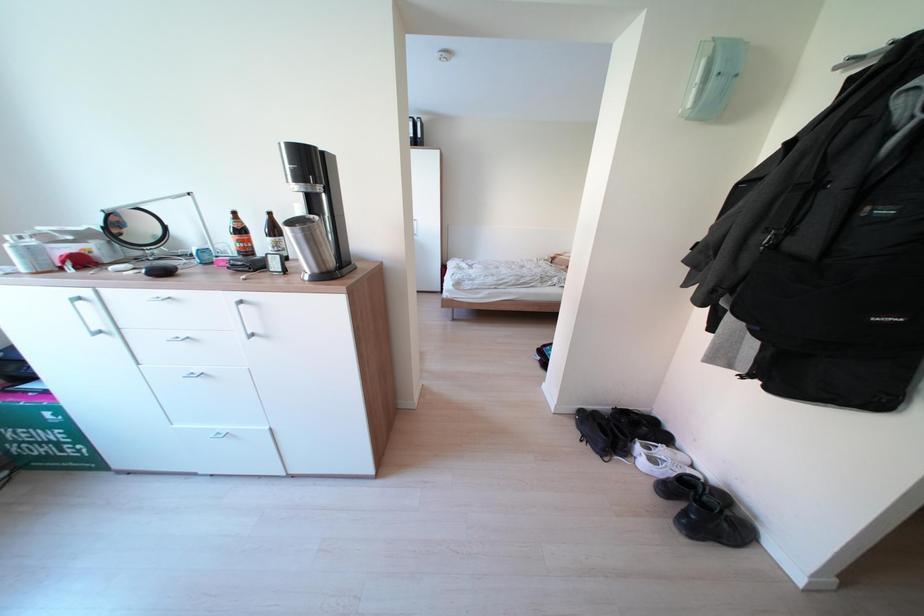
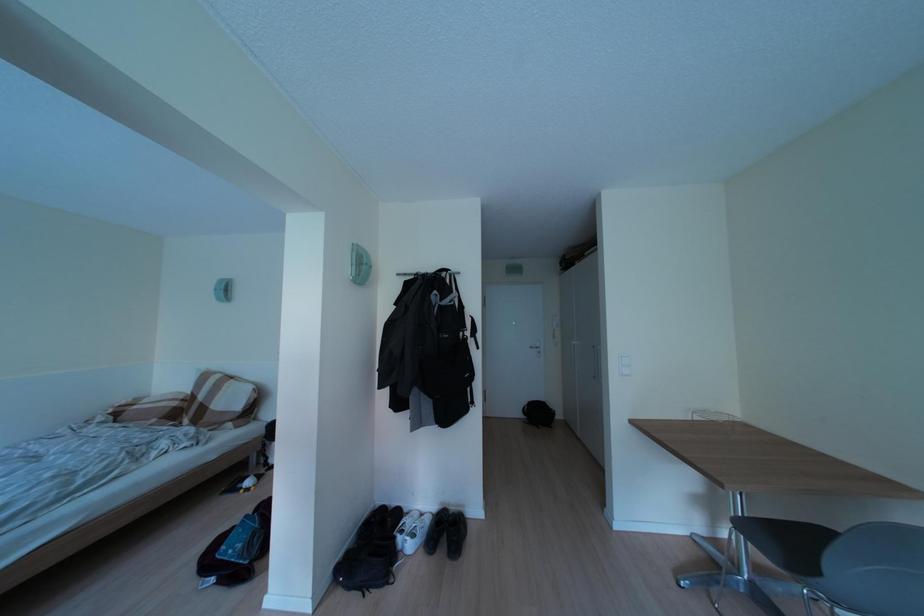
Question: Based on the continuous images, in which direction is the camera rotating? Reply with the corresponding letter.

Choices:
 (A) Left
 (B) Right
 (C) Up
 (D) Down

Answer: (B)